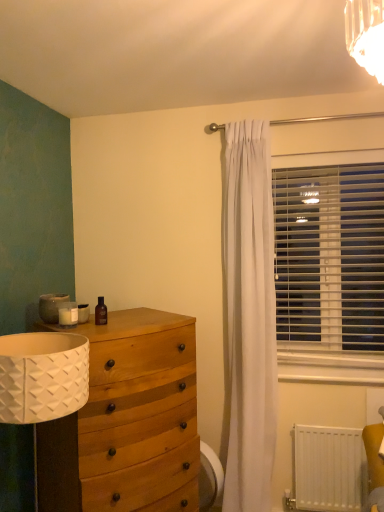
At what (x,y) coordinates should I click in order to perform the action: click on free spot above white plastic blinds at right (from a real-world perspective). Please return your answer as a coordinate pair (x, y). Looking at the image, I should click on (324, 166).